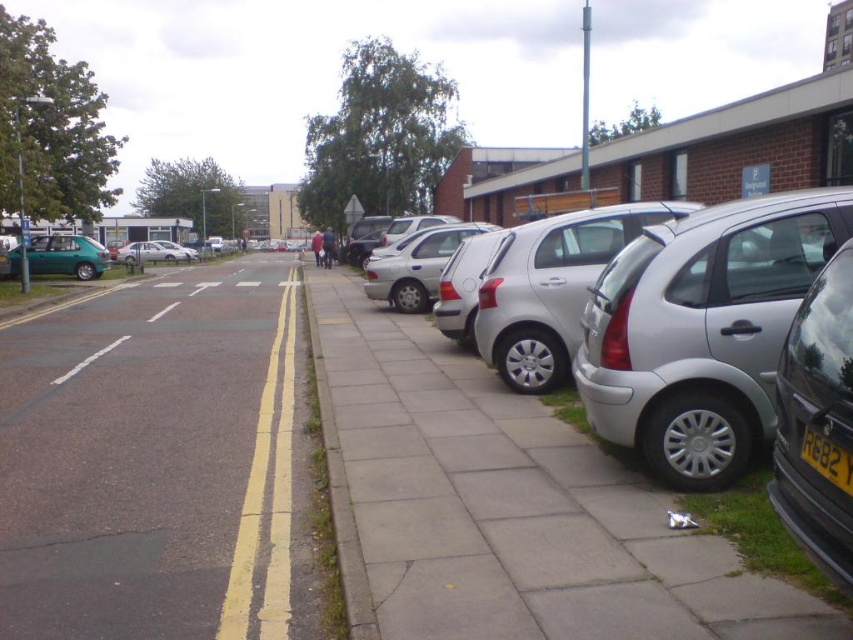
You are a delivery person who needs to park your van between the silver metallic hatchback at right and the metallic green hatchback at left. Is there enough space between them to park your van that is 6 meters long?

The silver metallic hatchback at right is smaller than the metallic green hatchback at left, but the exact distance between them isn not provided in the description. Therefore, it is impossible to determine if there is enough space for a 6 meter long van.